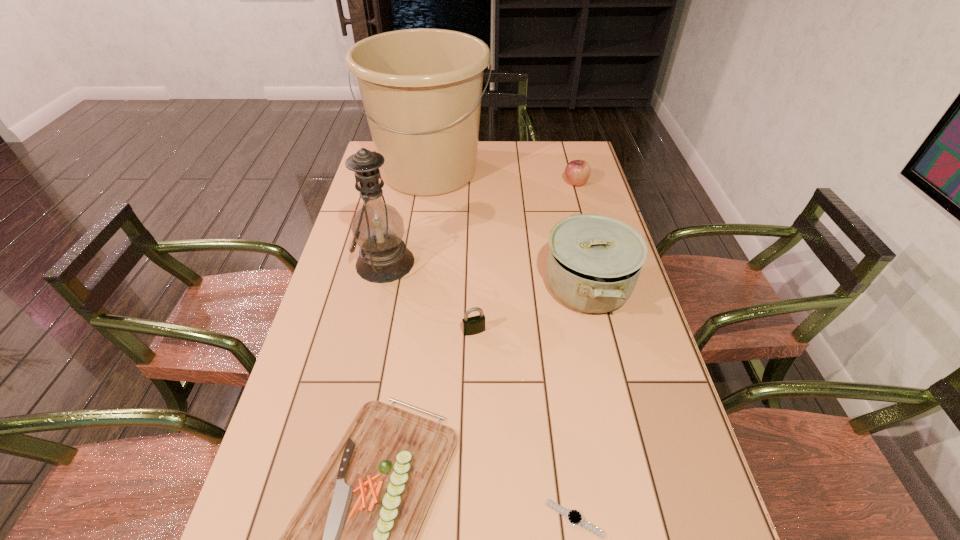
What are the coordinates of `bucket` in the screenshot? It's located at (421, 89).

At what (x,y) coordinates should I click in order to perform the action: click on oil lamp. Please return your answer as a coordinate pair (x, y). Looking at the image, I should click on (x=377, y=227).

Locate an element on the screen. the third tallest object is located at coordinates (594, 261).

At what (x,y) coordinates should I click in order to perform the action: click on apple. Please return your answer as a coordinate pair (x, y). The height and width of the screenshot is (540, 960). Looking at the image, I should click on (577, 172).

I want to click on padlock, so click(x=473, y=325).

At what (x,y) coordinates should I click in order to perform the action: click on watch. Please return your answer as a coordinate pair (x, y). Image resolution: width=960 pixels, height=540 pixels. Looking at the image, I should click on click(x=574, y=517).

Where is `free space located 0.140m on the front of the bucket`? This screenshot has width=960, height=540. free space located 0.140m on the front of the bucket is located at coordinates (420, 231).

At what (x,y) coordinates should I click in order to perform the action: click on vacant space located on the back of the oil lamp. Please return your answer as a coordinate pair (x, y). The height and width of the screenshot is (540, 960). Looking at the image, I should click on (400, 192).

Identify the location of vacant region located on the front of the third tallest object. (635, 489).

Where is `vacant space located 0.160m on the left of the fourth shortest object`? The height and width of the screenshot is (540, 960). vacant space located 0.160m on the left of the fourth shortest object is located at coordinates 520,183.